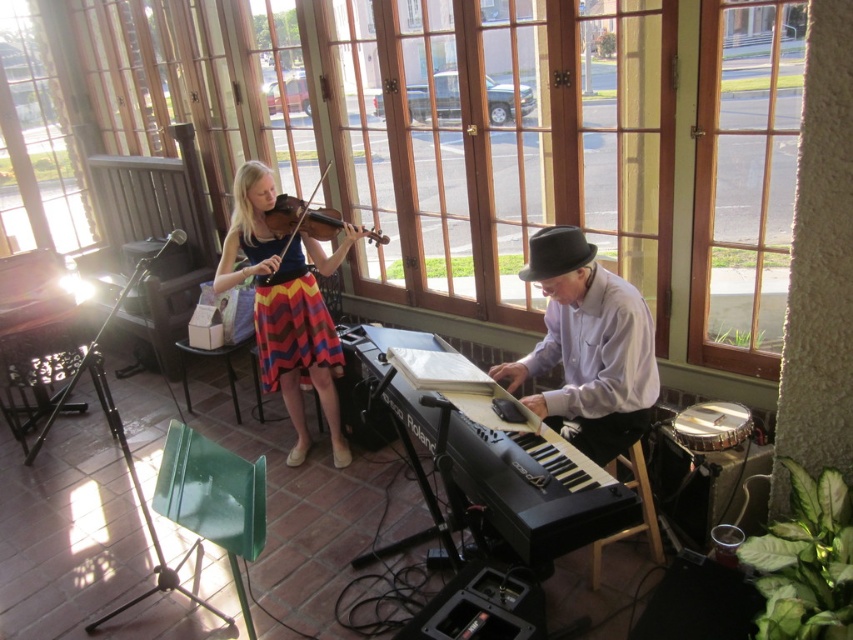
In the scene shown: You are a photographer standing at the camera position. You want to capture a closeup shot of the black plastic keyboard at center. Considering your current position, do you need to move closer or farther away to achieve this?

The black plastic keyboard at center is 1.83 meters away from the camera. To capture a closeup shot, you would need to move closer to reduce the distance between the camera and the keyboard.

You are a photographer setting up for a photoshoot in this room. You need to place a large tripod between the black plastic keyboard at center and the multicolored striped skirt at center. Since the keyboard is larger, will the space between them be sufficient for the tripod?

The black plastic keyboard at center has a larger size compared to multicolored striped skirt at center, so the space between them may be sufficient for the tripod depending on the tripod size, but the description does not provide exact measurements. However, since the keyboard is larger, there might be enough space between them for placement.

You are standing in the room and want to move to the point marked as point (x=604, y=385). If you are 5 feet tall, will your head hit the ceiling when you reach that point?

The point (x=604, y=385) is 8.45 feet away from the viewer. Since the height of the room isn not mentioned, we cannot determine if the head will hit the ceiling.